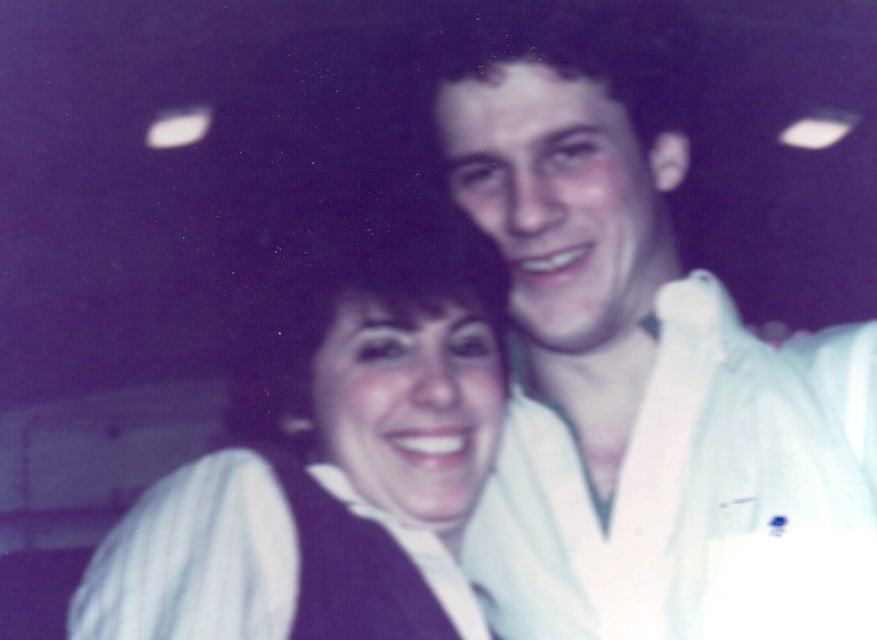
Question: Which object appears farthest from the camera in this image?

Choices:
 (A) matte white shirt at center
 (B) white cotton robe at upper right

Answer: (B)

Question: Can you confirm if white cotton robe at upper right is smaller than white striped fabric at center?

Choices:
 (A) yes
 (B) no

Answer: (B)

Question: Does white cotton robe at upper right appear on the right side of white striped fabric at center?

Choices:
 (A) no
 (B) yes

Answer: (B)

Question: Is matte white shirt at center smaller than white striped fabric at center?

Choices:
 (A) yes
 (B) no

Answer: (B)

Question: Considering the real-world distances, which object is farthest from the white cotton robe at upper right?

Choices:
 (A) matte white shirt at center
 (B) white striped fabric at center

Answer: (B)

Question: Based on their relative distances, which object is farther from the white striped fabric at center?

Choices:
 (A) white cotton robe at upper right
 (B) matte white shirt at center

Answer: (A)